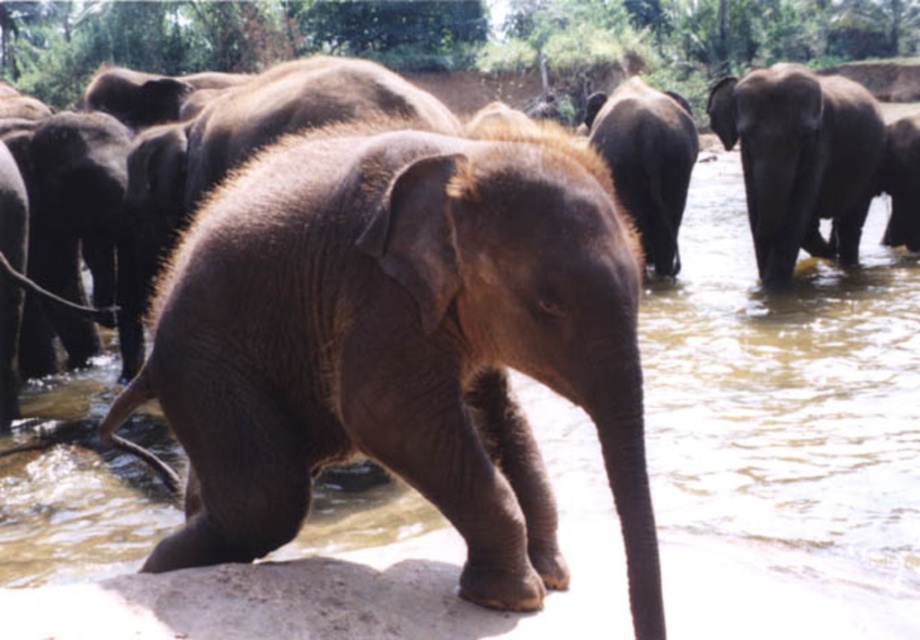
You are an elephant researcher observing the elephants in the scene. You need to identify which elephant is shorter between the dark brown wrinkled elephant at right and the dark brown wrinkled elephant at center. Which one is shorter?

The dark brown wrinkled elephant at right is shorter than the dark brown wrinkled elephant at center.

You are a wildlife photographer trying to capture a photo of both the dark brown wrinkled elephant at right and the dark brown wrinkled elephant at center. Your camera has a zoom lens that can focus on subjects within a 1.5 meter range. Can you fit both elephants into the frame without moving the camera?

The dark brown wrinkled elephant at right is 1.47 meters away from the dark brown wrinkled elephant at center. Since the distance between them is within the 1.5 meter range of your camera, you can fit both elephants into the frame without moving the camera.